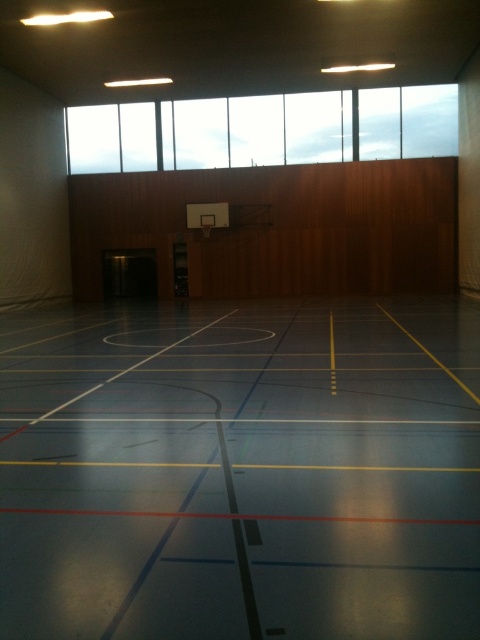
Between point (241, 152) and point (201, 220), which one is positioned behind?

The point (241, 152) is more distant.

Which is more to the right, transparent glass windows at upper center or metallic silver basketball hoop at center?

From the viewer's perspective, transparent glass windows at upper center appears more on the right side.

Image resolution: width=480 pixels, height=640 pixels. What do you see at coordinates (256, 131) in the screenshot?
I see `transparent glass windows at upper center` at bounding box center [256, 131].

Identify the location of transparent glass windows at upper center. pos(256,131).